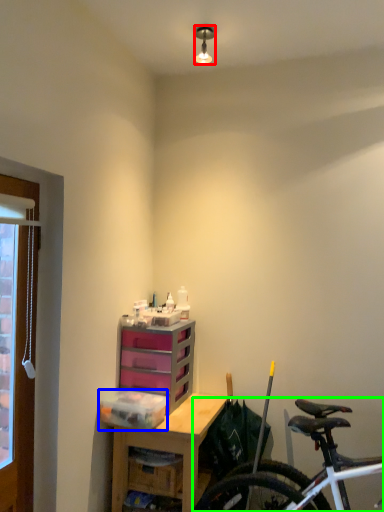
Question: Considering the real-world distances, which object is farthest from lamp (highlighted by a red box)? storage box (highlighted by a blue box) or bicycle (highlighted by a green box)?

Choices:
 (A) storage box
 (B) bicycle

Answer: (B)